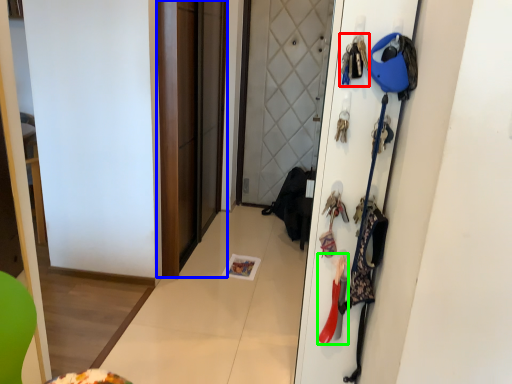
Question: Considering the real-world distances, which object is farthest from accessory (highlighted by a red box)? screen door (highlighted by a blue box) or accessory (highlighted by a green box)?

Choices:
 (A) screen door
 (B) accessory

Answer: (A)